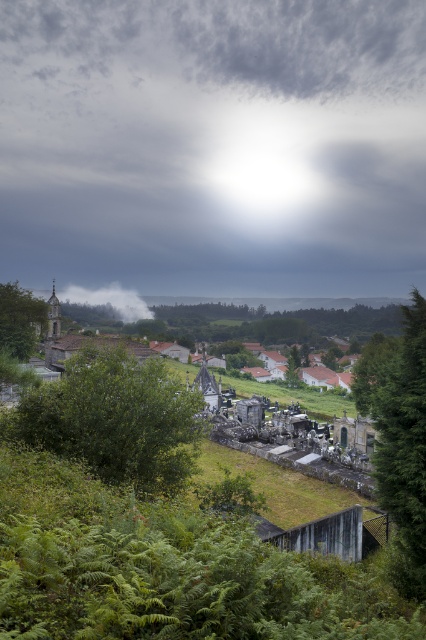
Question: Which object is the closest to the green leafy tree at right?

Choices:
 (A) green leafy bush at center
 (B) green matte tree at lower left
 (C) white fog at center
 (D) cloudy sky at upper center

Answer: (A)

Question: Which point is closer to the camera?

Choices:
 (A) green leafy bush at center
 (B) green matte tree at lower left

Answer: (A)

Question: Which point appears closest to the camera in this image?

Choices:
 (A) (134, 221)
 (B) (6, 288)
 (C) (425, 531)

Answer: (C)

Question: Does cloudy sky at upper center appear over white fog at center?

Choices:
 (A) no
 (B) yes

Answer: (B)

Question: Is cloudy sky at upper center to the right of green leafy tree at right from the viewer's perspective?

Choices:
 (A) yes
 (B) no

Answer: (B)

Question: Does green leafy bush at center appear over green leafy tree at right?

Choices:
 (A) yes
 (B) no

Answer: (B)